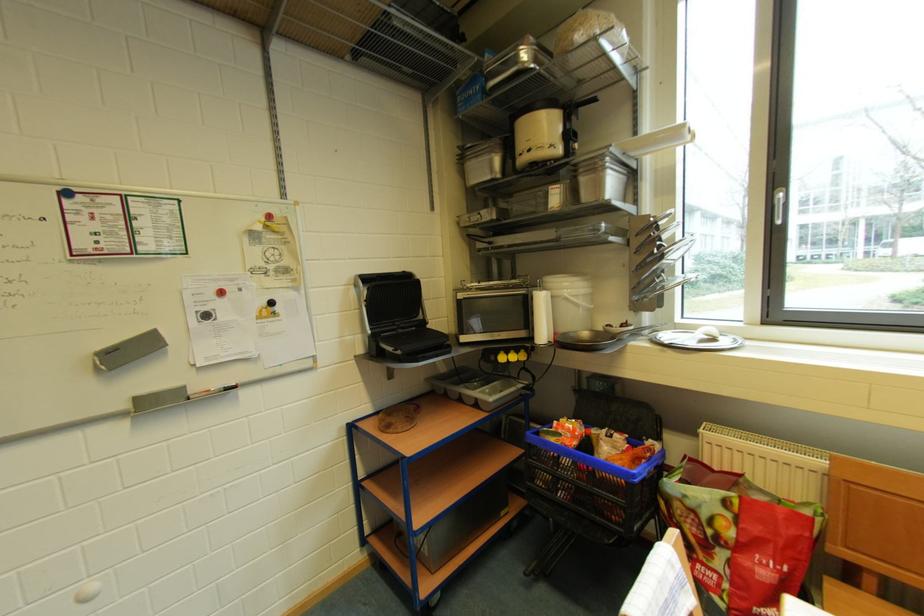
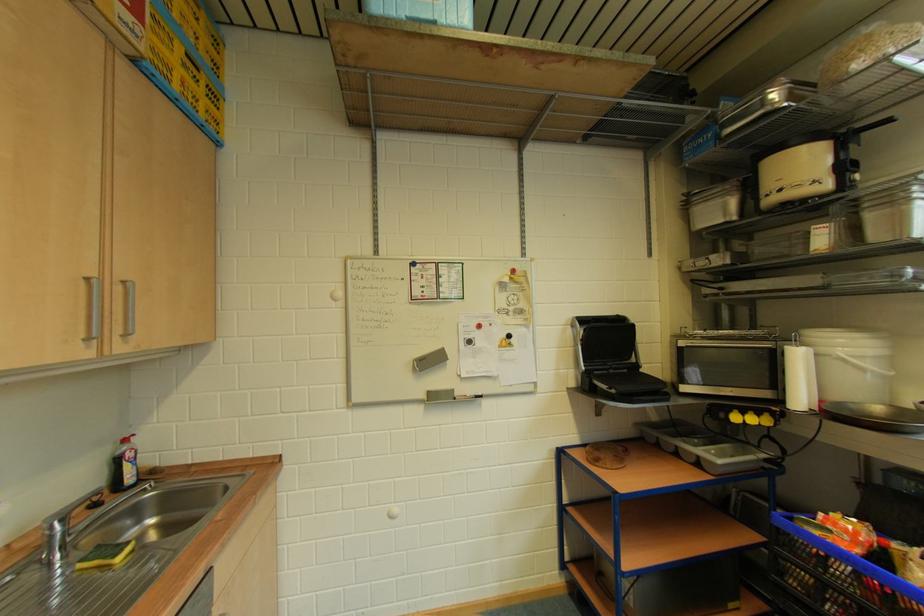
In the second image, find the point that corresponds to (578,299) in the first image.

(858, 360)